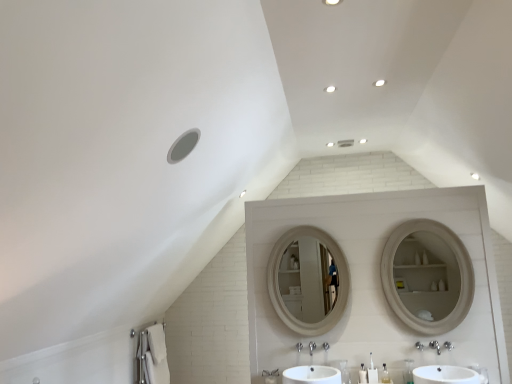
Question: In terms of height, does white wooden mirror at center look taller or shorter compared to white plastic pump at center, arranged as the 2th toiletry when viewed from the left?

Choices:
 (A) short
 (B) tall

Answer: (B)

Question: From a real-world perspective, is white wooden mirror at center physically located above or below white plastic pump at center, the third toiletry when ordered from right to left?

Choices:
 (A) above
 (B) below

Answer: (A)

Question: Based on their relative distances, which object is nearer to the white glossy sink at center, which ranks as the 1th sink in left-to-right order?

Choices:
 (A) white plastic pump at center, arranged as the 2th toiletry when viewed from the left
 (B) brushed metal faucet at center, which appears as the first plumbing fixture when viewed from the left
 (C) white glossy sink at lower center, which is the first sink from right to left
 (D) white plastic toothbrush at lower center, which appears as the first toiletry when viewed from the left
 (E) white cotton bath towel at lower left

Answer: (D)

Question: Which of these objects is positioned farthest from the white cotton bath towel at lower left?

Choices:
 (A) white plastic pump at center, arranged as the 2th toiletry when viewed from the left
 (B) silver metallic faucet at center, which is the 2th plumbing fixture from left to right
 (C) brushed metal faucet at center, which appears as the first plumbing fixture when viewed from the left
 (D) white plastic toothbrush at lower center, placed as the fourth toiletry when sorted from right to left
 (E) white wooden mirror at center

Answer: (A)